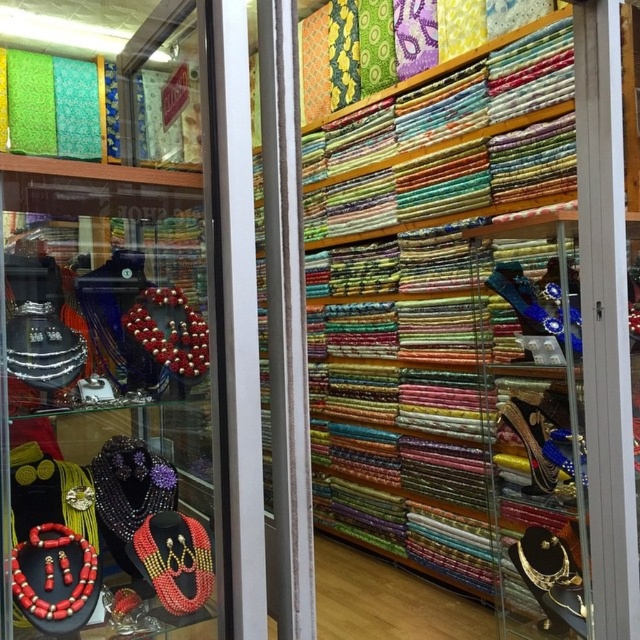
Can you confirm if matte black jewelry at left is bigger than metallic gold shoe at center-right?

Yes, matte black jewelry at left is bigger than metallic gold shoe at center-right.

Is matte black jewelry at left further to camera compared to metallic gold shoe at center-right?

No, matte black jewelry at left is closer to the viewer.

Identify the location of matte black jewelry at left. The height and width of the screenshot is (640, 640). (108, 348).

This screenshot has height=640, width=640. Find the location of `matte black jewelry at left`. matte black jewelry at left is located at coordinates (108, 348).